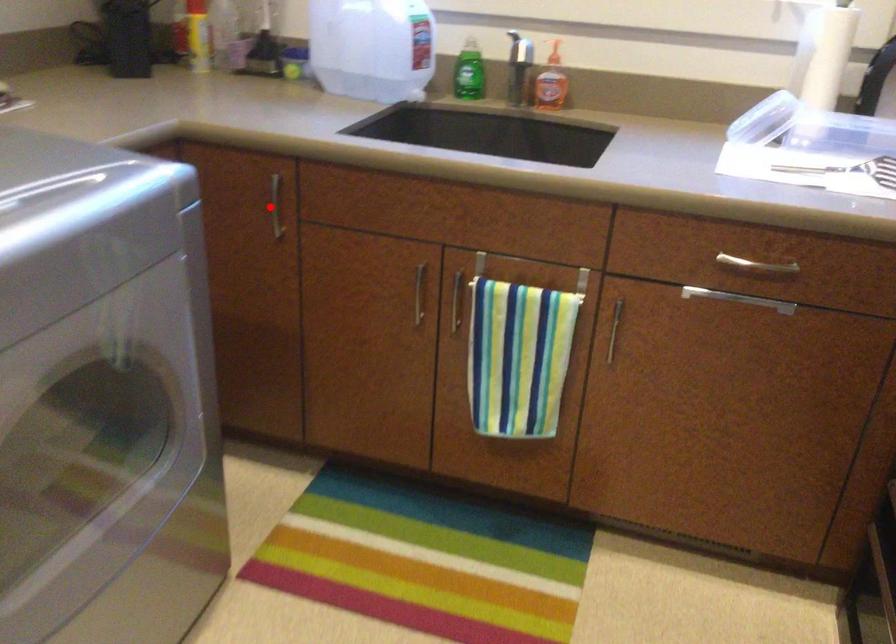
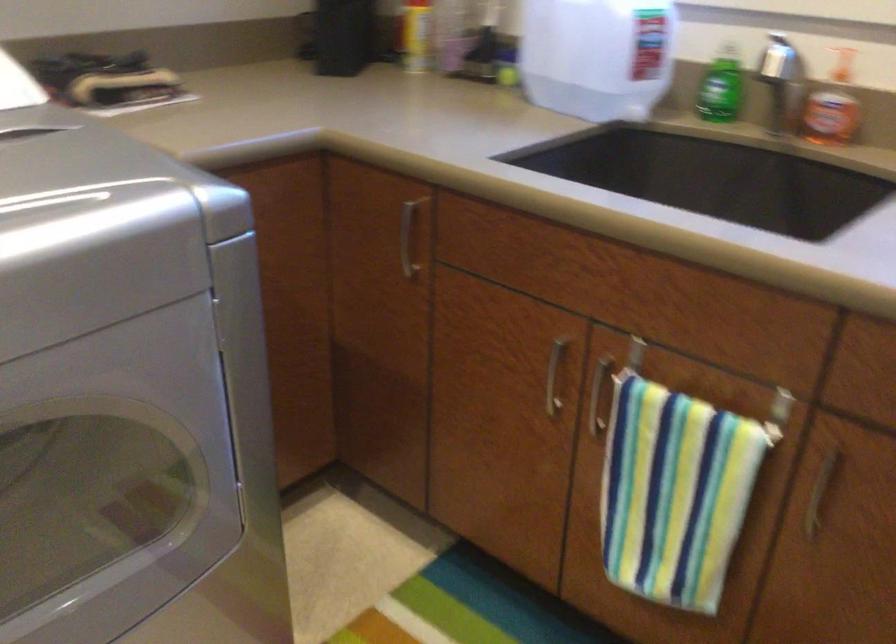
The point at the highlighted location is marked in the first image. Where is the corresponding point in the second image?

(407, 238)